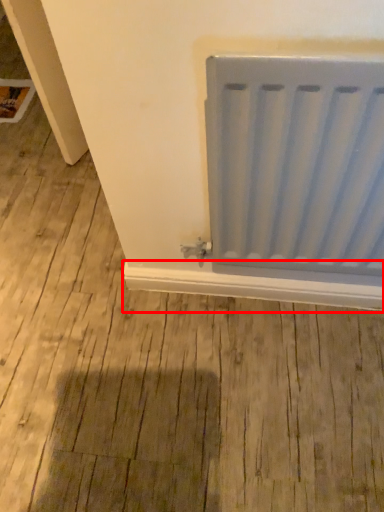
Question: From the image's perspective, where is window sill (annotated by the red box) located relative to radiator?

Choices:
 (A) below
 (B) above

Answer: (A)